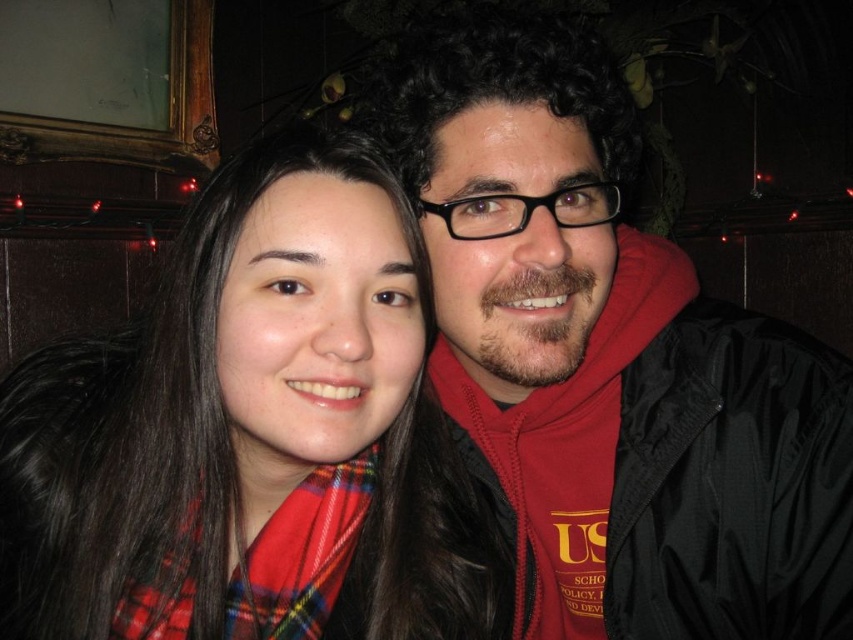
Which of these two, black matte jacket at right or plaid scarf at left, stands shorter?

plaid scarf at left is shorter.

Is black matte jacket at right wider than plaid scarf at left?

Yes, black matte jacket at right is wider than plaid scarf at left.

Identify the location of black matte jacket at right. This screenshot has width=853, height=640. point(611,362).

You are a GUI agent. You are given a task and a screenshot of the screen. Output one action in this format:
    pyautogui.click(x=<x>, y=<y>)
    Task: Click on the black matte jacket at right
    The height and width of the screenshot is (640, 853).
    Given the screenshot: What is the action you would take?
    pyautogui.click(x=611, y=362)